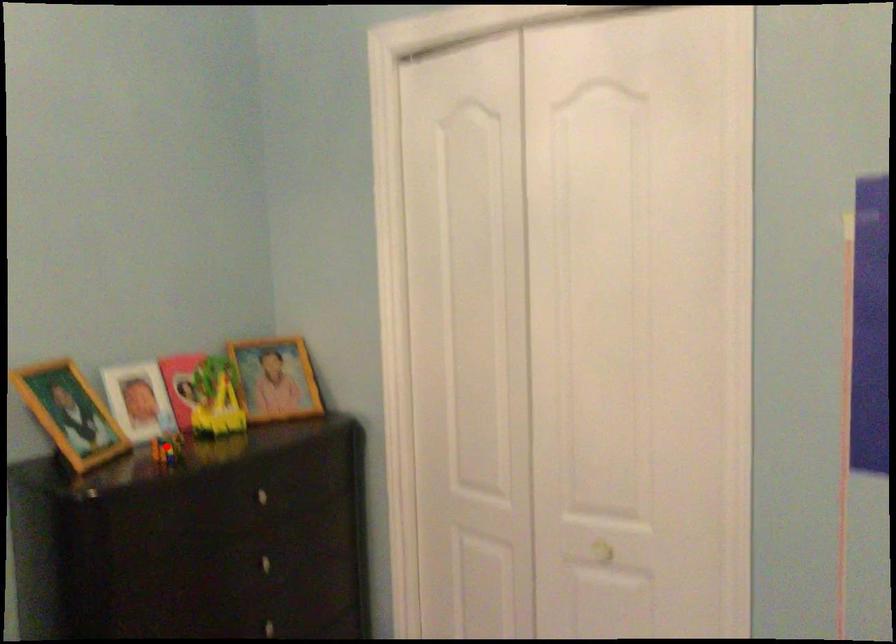
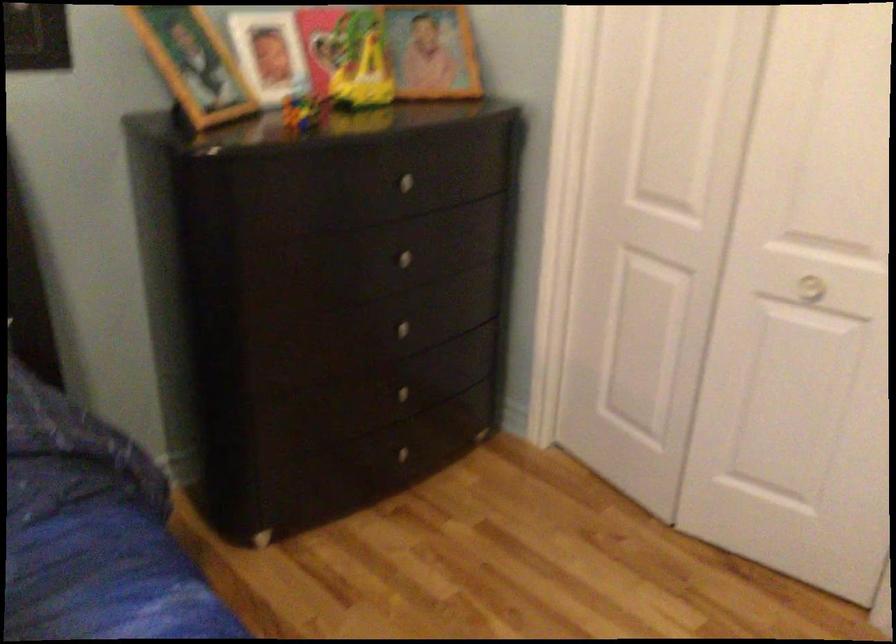
Locate, in the second image, the point that corresponds to the highlighted location in the first image.

(303, 111)